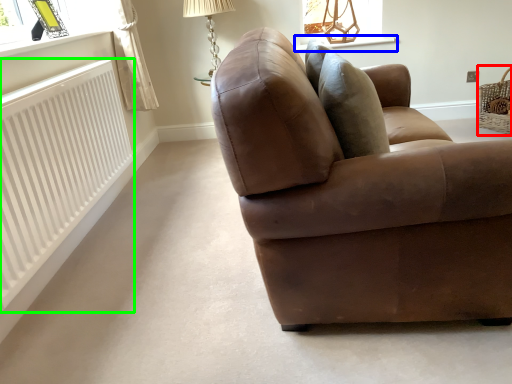
Question: Which object is positioned farthest from basket (highlighted by a red box)? Select from window sill (highlighted by a blue box) and radiator (highlighted by a green box).

Choices:
 (A) window sill
 (B) radiator

Answer: (B)